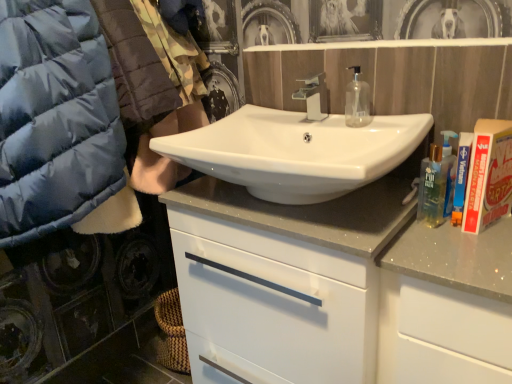
Question: Does transparent plastic mouthwash at center have a larger size compared to matte blue puffer jacket at left?

Choices:
 (A) no
 (B) yes

Answer: (A)

Question: Is transparent plastic mouthwash at center not within matte blue puffer jacket at left?

Choices:
 (A) no
 (B) yes

Answer: (B)

Question: Considering the relative sizes of transparent plastic mouthwash at center and matte blue puffer jacket at left in the image provided, is transparent plastic mouthwash at center shorter than matte blue puffer jacket at left?

Choices:
 (A) yes
 (B) no

Answer: (A)

Question: Can you confirm if transparent plastic mouthwash at center is thinner than matte blue puffer jacket at left?

Choices:
 (A) yes
 (B) no

Answer: (A)

Question: Does transparent plastic mouthwash at center have a greater width compared to matte blue puffer jacket at left?

Choices:
 (A) yes
 (B) no

Answer: (B)

Question: Considering the positions of transparent plastic mouthwash at center and silver metallic faucet at center in the image, is transparent plastic mouthwash at center wider or thinner than silver metallic faucet at center?

Choices:
 (A) thin
 (B) wide

Answer: (A)

Question: From the image's perspective, is transparent plastic mouthwash at center above or below silver metallic faucet at center?

Choices:
 (A) above
 (B) below

Answer: (B)

Question: In the image, is transparent plastic mouthwash at center positioned in front of or behind silver metallic faucet at center?

Choices:
 (A) front
 (B) behind

Answer: (A)

Question: Is point (350, 96) positioned closer to the camera than point (312, 104)?

Choices:
 (A) closer
 (B) farther

Answer: (B)

Question: From a real-world perspective, is white glossy sink at center positioned above or below transparent plastic mouthwash at center?

Choices:
 (A) above
 (B) below

Answer: (B)

Question: Is white glossy sink at center taller or shorter than transparent plastic mouthwash at center?

Choices:
 (A) tall
 (B) short

Answer: (A)

Question: Which is correct: white glossy sink at center is inside transparent plastic mouthwash at center, or outside of it?

Choices:
 (A) outside
 (B) inside

Answer: (A)

Question: Is point (190, 150) closer or farther from the camera than point (364, 84)?

Choices:
 (A) closer
 (B) farther

Answer: (A)

Question: From the image's perspective, is silver metallic faucet at center positioned above or below transparent plastic mouthwash at center?

Choices:
 (A) below
 (B) above

Answer: (B)

Question: Do you think silver metallic faucet at center is within transparent plastic mouthwash at center, or outside of it?

Choices:
 (A) outside
 (B) inside

Answer: (A)